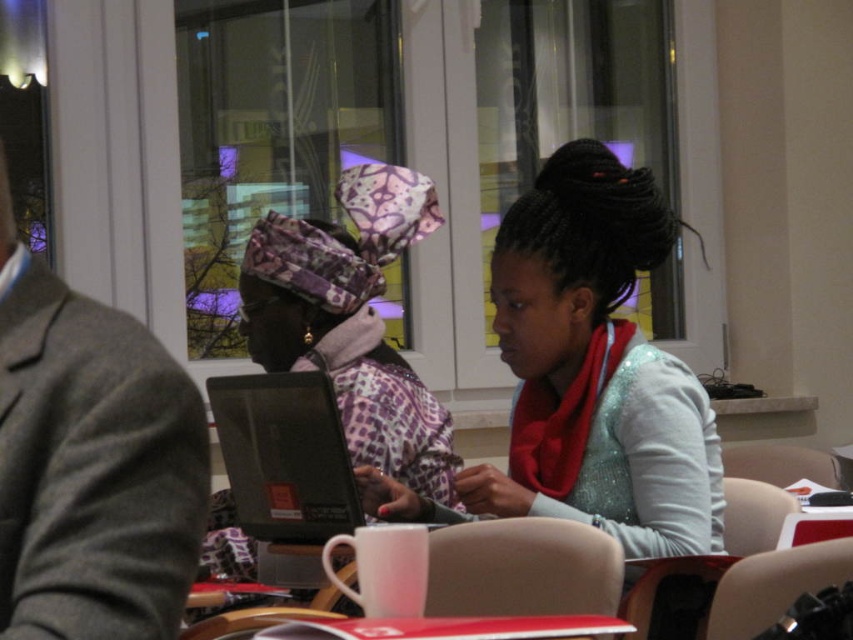
Question: Which object is positioned closest to the black glossy laptop at center?

Choices:
 (A) satin silver scarf at center
 (B) gray wool jacket at left

Answer: (A)

Question: Which object is the closest to the satin silver scarf at center?

Choices:
 (A) black glossy laptop at center
 (B) gray wool jacket at left

Answer: (A)

Question: Which object is the closest to the black glossy laptop at center?

Choices:
 (A) gray wool jacket at left
 (B) satin silver scarf at center

Answer: (B)

Question: Observing the image, what is the correct spatial positioning of satin silver scarf at center in reference to black glossy laptop at center?

Choices:
 (A) left
 (B) right

Answer: (B)

Question: Where is satin silver scarf at center located in relation to gray wool jacket at left in the image?

Choices:
 (A) below
 (B) above

Answer: (B)

Question: Considering the relative positions of gray wool jacket at left and black glossy laptop at center in the image provided, where is gray wool jacket at left located with respect to black glossy laptop at center?

Choices:
 (A) right
 (B) left

Answer: (B)